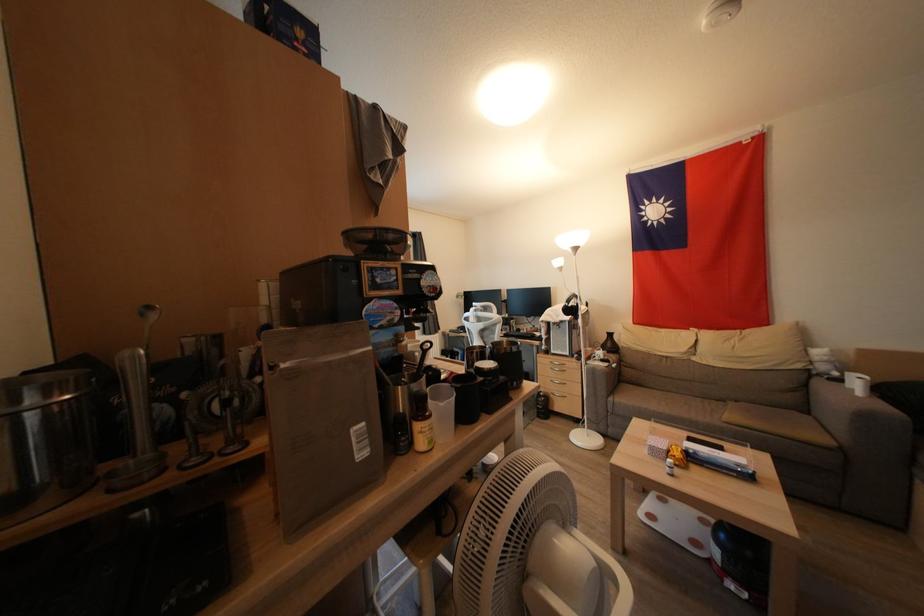
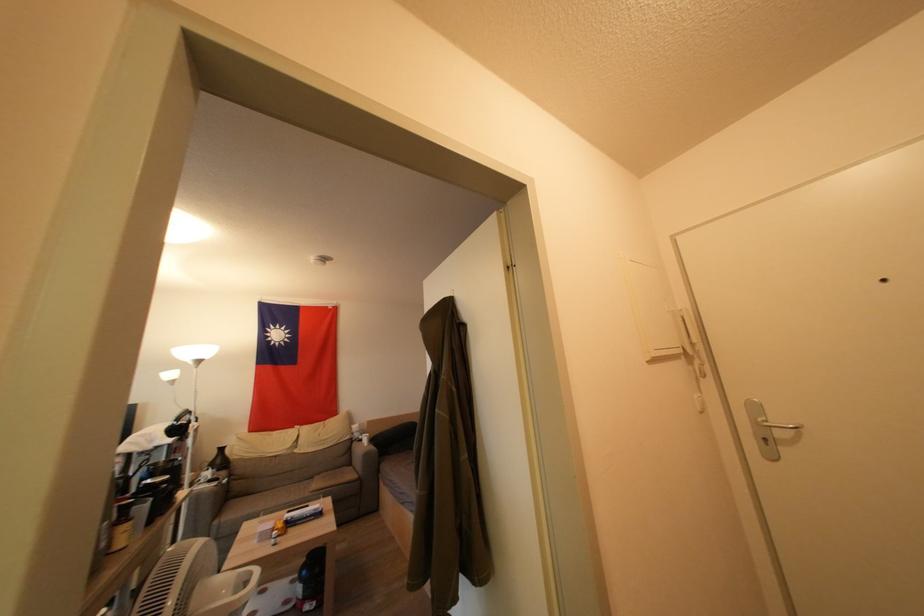
The point at (614,349) is marked in the first image. Where is the corresponding point in the second image?

(224, 464)